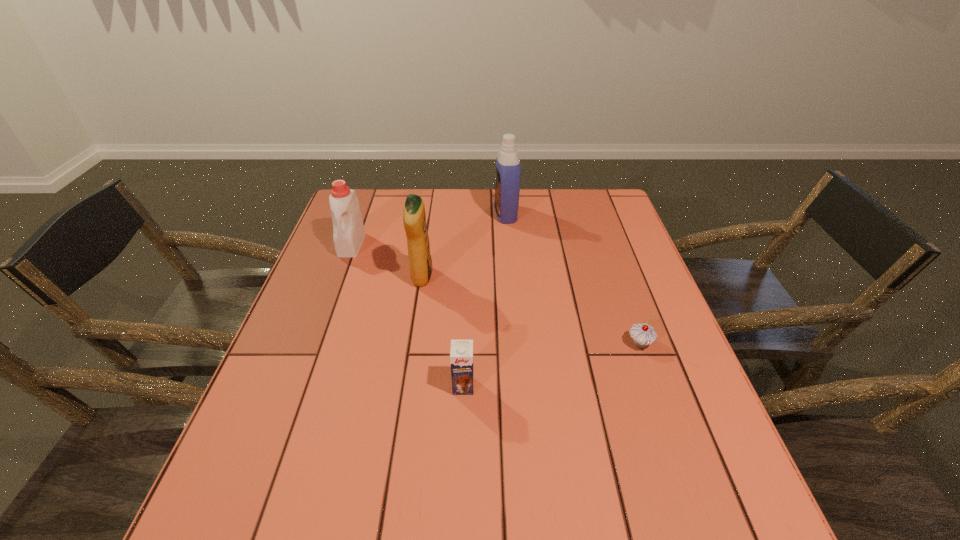
Find the location of a particular element. The width and height of the screenshot is (960, 540). blank space at the left edge of the desktop is located at coordinates (357, 287).

You are a GUI agent. You are given a task and a screenshot of the screen. Output one action in this format:
    pyautogui.click(x=<x>, y=<y>)
    Task: Click on the blank space at the right edge of the desktop
    
    Given the screenshot: What is the action you would take?
    pyautogui.click(x=620, y=290)

This screenshot has width=960, height=540. In the image, there is a desktop. Find the location of `vacant space at the far right corner`. vacant space at the far right corner is located at coordinates (611, 207).

Find the location of `unoccupied area between the rightmost object and the third tallest object`. unoccupied area between the rightmost object and the third tallest object is located at coordinates (495, 294).

I want to click on vacant area that lies between the chocolate milk and the farthest object, so click(x=485, y=300).

What are the coordinates of `vacant space that is in between the shortest detergent and the second shortest object` in the screenshot? It's located at (407, 315).

Locate an element on the screen. unoccupied area between the chocolate milk and the fourth object from right to left is located at coordinates (443, 332).

Where is `free area in between the farthest object and the chocolate milk`? This screenshot has height=540, width=960. free area in between the farthest object and the chocolate milk is located at coordinates (485, 300).

This screenshot has width=960, height=540. In order to click on blank region between the farthest object and the second nearest object in this screenshot , I will do `click(573, 279)`.

I want to click on free spot between the second detergent from left to right and the rightmost detergent, so click(x=464, y=246).